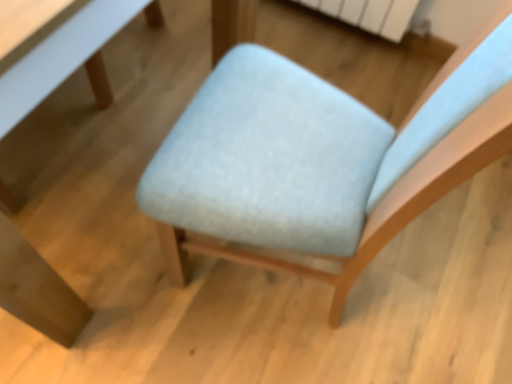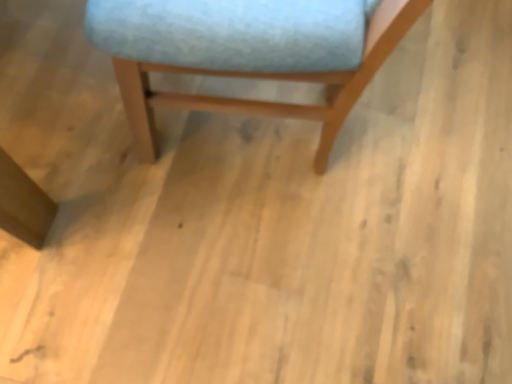
Question: How did the camera likely rotate when shooting the video?

Choices:
 (A) rotated upward
 (B) rotated downward

Answer: (B)